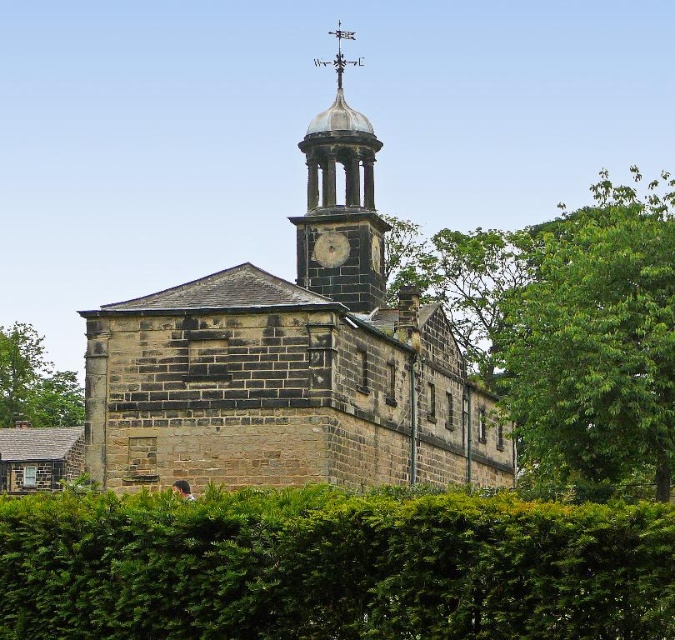
Question: Considering the relative positions of green leafy tree at upper right and green leafy tree at lower left in the image provided, where is green leafy tree at upper right located with respect to green leafy tree at lower left?

Choices:
 (A) above
 (B) below

Answer: (A)

Question: Can you confirm if brown stone church at center is wider than green leafy tree at lower left?

Choices:
 (A) yes
 (B) no

Answer: (A)

Question: Which point is closer to the camera taking this photo?

Choices:
 (A) (319, 124)
 (B) (327, 228)
 (C) (38, 515)
 (D) (80, 394)

Answer: (C)

Question: Which point is closer to the camera taking this photo?

Choices:
 (A) (11, 422)
 (B) (375, 291)
 (C) (313, 244)

Answer: (B)

Question: From the image, what is the correct spatial relationship of dark gray stone clock tower at upper center in relation to metallic clock face at center?

Choices:
 (A) left
 (B) right

Answer: (A)

Question: Among these points, which one is farthest from the camera?

Choices:
 (A) (485, 422)
 (B) (618, 240)
 (C) (335, 262)

Answer: (A)